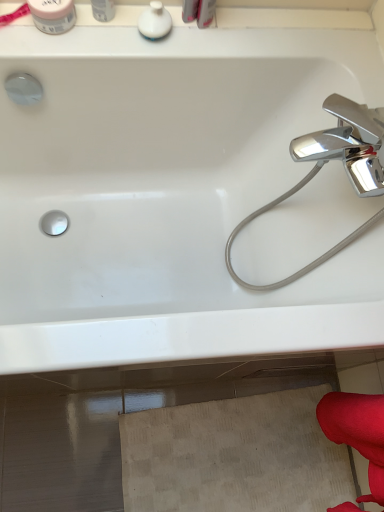
Locate an element on the screen. The image size is (384, 512). free spot in front of white glossy soap dispenser at upper center, which ranks as the first toiletry in right-to-left order is located at coordinates (134, 54).